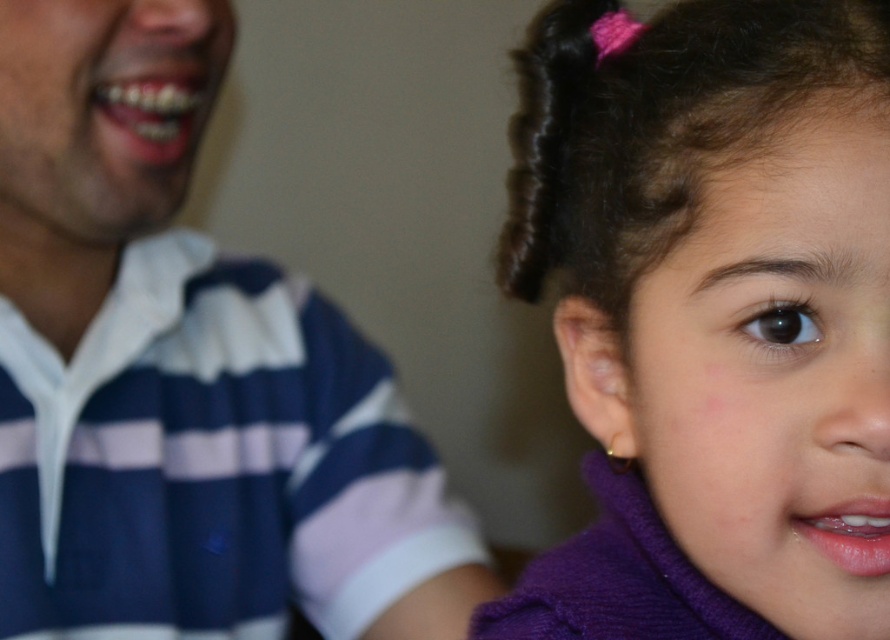
Is striped cotton shirt at left taller than dark brown curly hair at upper right?

Yes, striped cotton shirt at left is taller than dark brown curly hair at upper right.

Is point (135, 384) farther from camera compared to point (766, 106)?

That is True.

Locate an element on the screen. This screenshot has height=640, width=890. striped cotton shirt at left is located at coordinates (209, 461).

Which is more to the left, purple fuzzy sweater at right or dark brown curly hair at upper right?

Positioned to the left is dark brown curly hair at upper right.

Is purple fuzzy sweater at right taller than dark brown curly hair at upper right?

Yes, purple fuzzy sweater at right is taller than dark brown curly hair at upper right.

Which is behind, point (759, 88) or point (712, 58)?

Point (712, 58)

The image size is (890, 640). I want to click on purple fuzzy sweater at right, so click(712, 314).

Is purple fuzzy sweater at right shorter than striped cotton shirt at left?

Yes, purple fuzzy sweater at right is shorter than striped cotton shirt at left.

Find the location of a particular element. Image resolution: width=890 pixels, height=640 pixels. purple fuzzy sweater at right is located at coordinates (712, 314).

Is point (814, 56) behind point (221, 429)?

That is False.

Find the location of a particular element. purple fuzzy sweater at right is located at coordinates (712, 314).